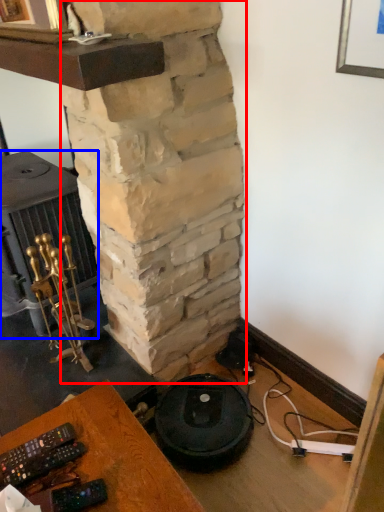
Question: Among these objects, which one is farthest to the camera, pillar (highlighted by a red box) or stove (highlighted by a blue box)?

Choices:
 (A) pillar
 (B) stove

Answer: (B)